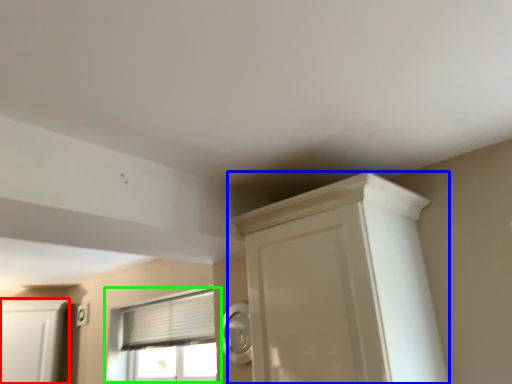
Question: Estimate the real-world distances between objects in this image. Which object is farther from cabinetry (highlighted by a red box), cupboard (highlighted by a blue box) or window (highlighted by a green box)?

Choices:
 (A) cupboard
 (B) window

Answer: (A)